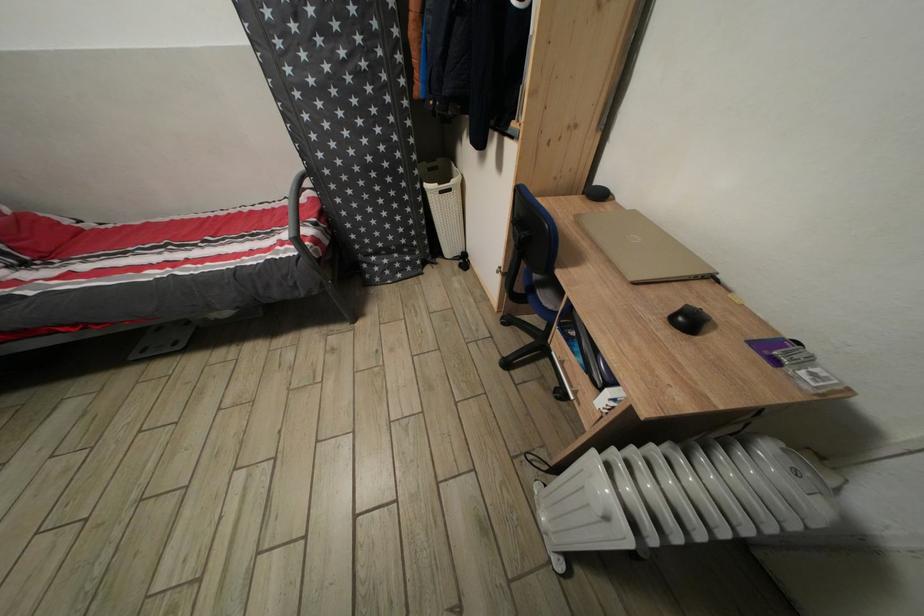
Where would you turn the heater control dial? Please return your answer as a coordinate pair (x, y).

(689, 500)